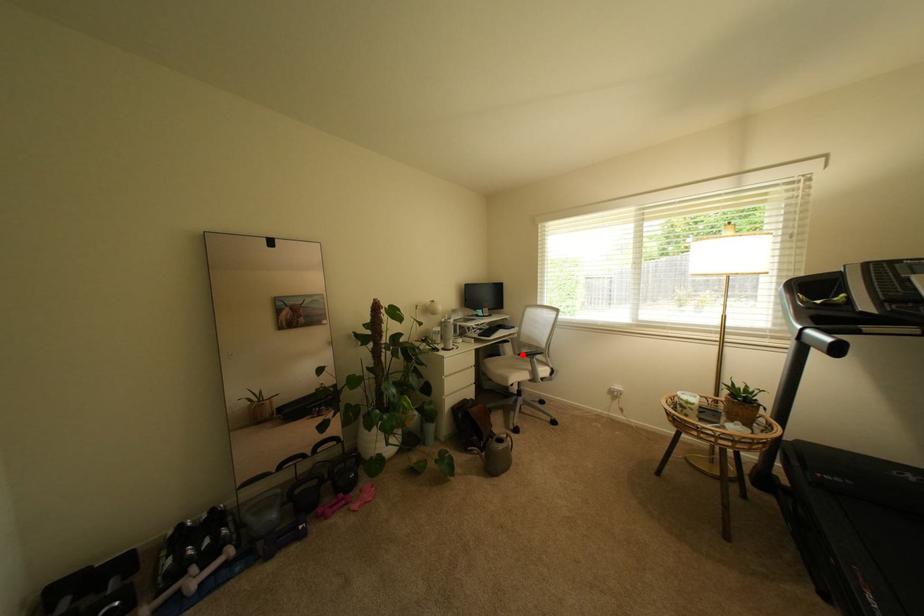
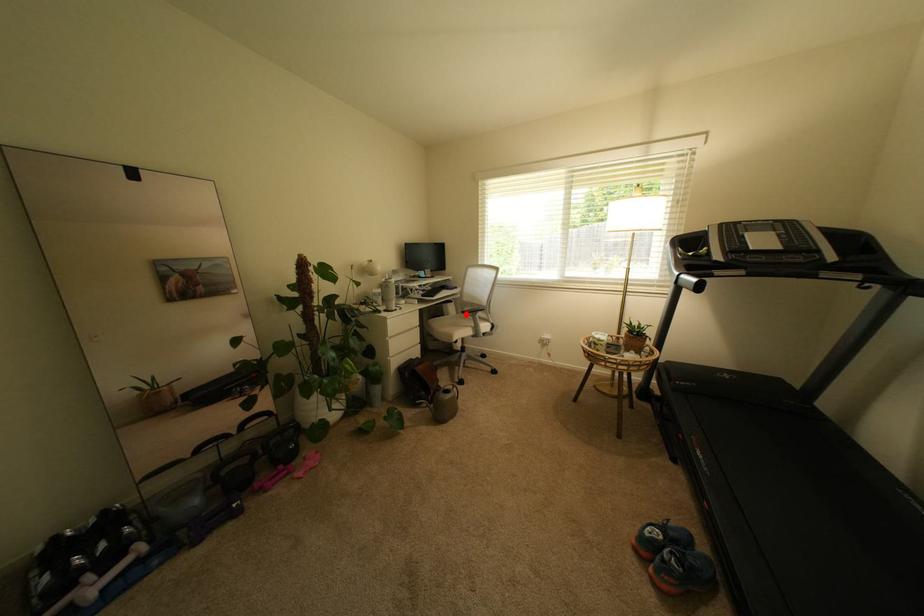
I am providing you with two images of the same scene from different viewpoints. A red point is marked on the first image and another point is marked on the second image. Does the point marked in image1 correspond to the same location as the one in image2?

Yes